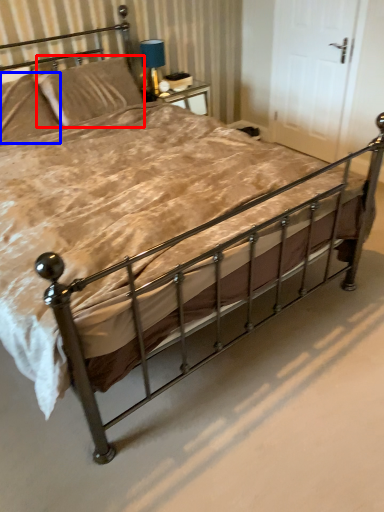
Question: Which of the following is the closest to the observer, pillow (highlighted by a red box) or pillow (highlighted by a blue box)?

Choices:
 (A) pillow
 (B) pillow

Answer: (B)